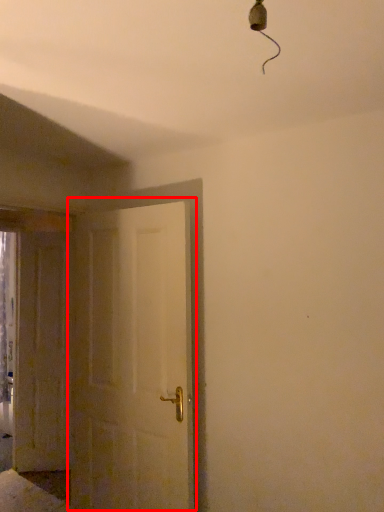
Question: Where is door (annotated by the red box) located in relation to door in the image?

Choices:
 (A) right
 (B) left

Answer: (A)